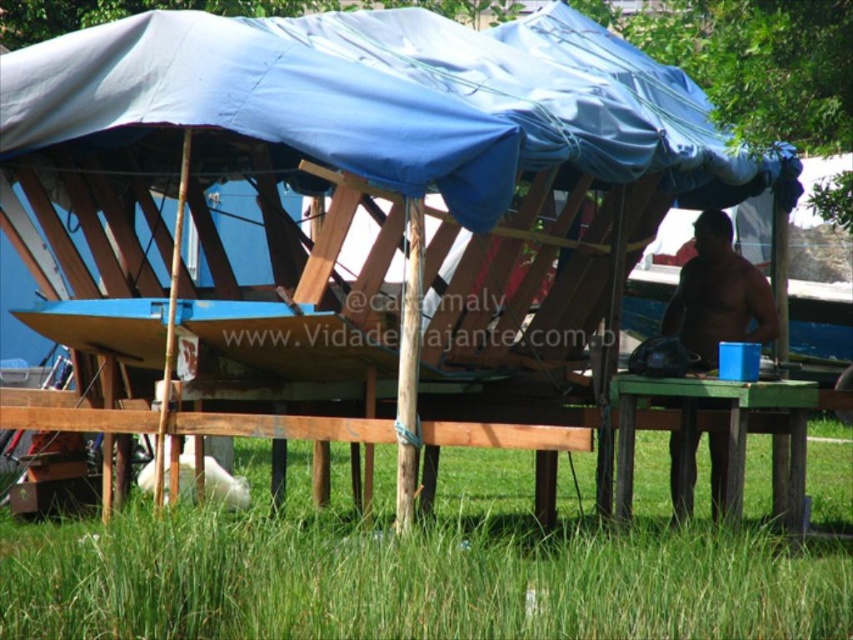
Question: Which point is farther from the camera taking this photo?

Choices:
 (A) (791, 435)
 (B) (143, 525)
 (C) (757, 278)

Answer: (C)

Question: Among these points, which one is nearest to the camera?

Choices:
 (A) (560, 525)
 (B) (721, 333)
 (C) (793, 516)

Answer: (C)

Question: Which point is farther to the camera?

Choices:
 (A) (726, 435)
 (B) (630, 484)

Answer: (A)

Question: Where is green grass at lower center located in relation to brown skin at right in the image?

Choices:
 (A) left
 (B) right

Answer: (A)

Question: Is green wooden picnic table at lower right bigger than brown skin at right?

Choices:
 (A) no
 (B) yes

Answer: (A)

Question: Does green grass at lower center have a greater width compared to brown skin at right?

Choices:
 (A) no
 (B) yes

Answer: (B)